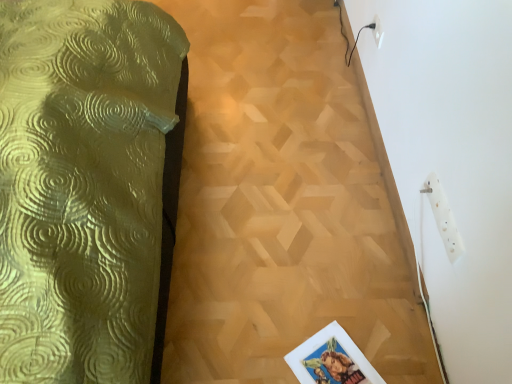
Question: Is point (349, 327) positioned closer to the camera than point (437, 188)?

Choices:
 (A) farther
 (B) closer

Answer: (A)

Question: From the image's perspective, is wooden parquet floor at center positioned above or below white plastic socket at upper right, placed as the second electric outlet when sorted from left to right?

Choices:
 (A) below
 (B) above

Answer: (B)

Question: Which object is the farthest from the wooden parquet floor at center?

Choices:
 (A) white plastic socket at upper right, placed as the second electric outlet when sorted from left to right
 (B) white plastic electric outlet at upper right, which is counted as the 1th electric outlet, starting from the top

Answer: (B)

Question: Estimate the real-world distances between objects in this image. Which object is farther from the wooden parquet floor at center?

Choices:
 (A) white plastic socket at upper right, the 1th electric outlet in the front-to-back sequence
 (B) white plastic electric outlet at upper right, which appears as the 1th electric outlet when viewed from the left

Answer: (B)